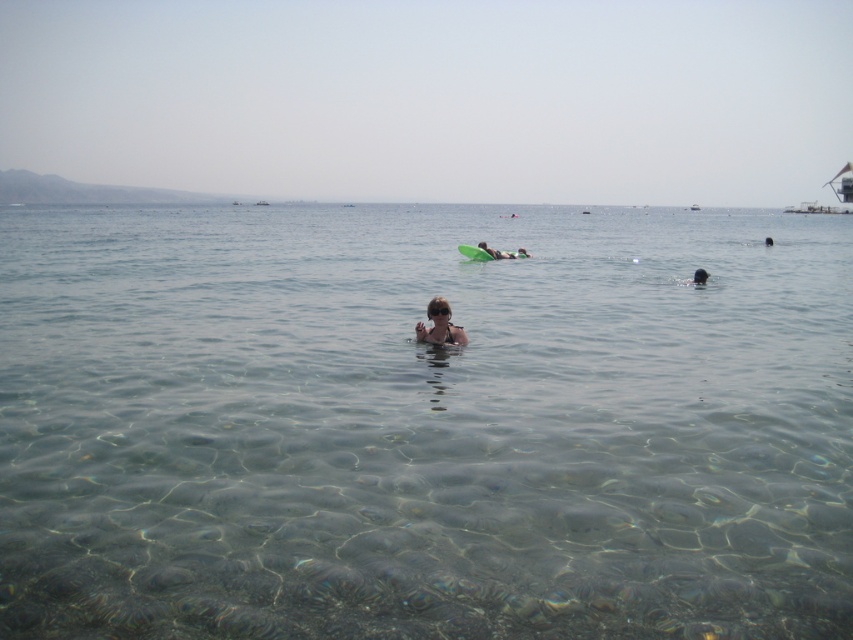
Between clear water at center and light brown skin at center, which one appears on the left side from the viewer's perspective?

Positioned to the left is clear water at center.

Which is below, clear water at center or light brown skin at center?

light brown skin at center is below.

Identify the location of clear water at center. The width and height of the screenshot is (853, 640). (422, 424).

Who is higher up, clear water at center or dark skin at center?

clear water at center is higher up.

Does clear water at center have a greater height compared to dark skin at center?

Correct, clear water at center is much taller as dark skin at center.

This screenshot has height=640, width=853. I want to click on clear water at center, so click(422, 424).

The width and height of the screenshot is (853, 640). Identify the location of clear water at center. (422, 424).

Who is taller, light brown skin at center or dark skin at center?

light brown skin at center is taller.

Does light brown skin at center have a smaller size compared to dark skin at center?

No, light brown skin at center is not smaller than dark skin at center.

Locate an element on the screen. Image resolution: width=853 pixels, height=640 pixels. light brown skin at center is located at coordinates (439, 324).